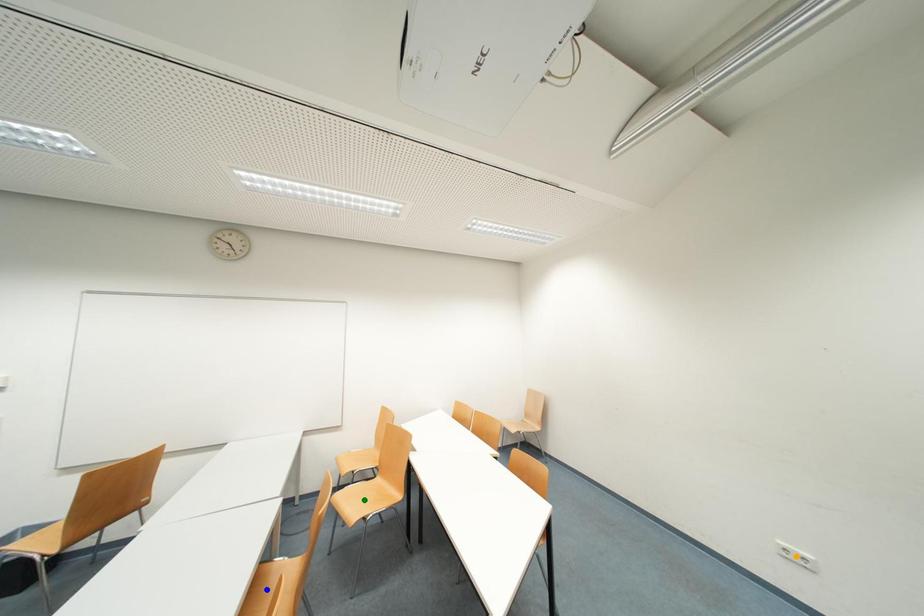
Order these from nearest to farthest:
green point
orange point
blue point

blue point, orange point, green point